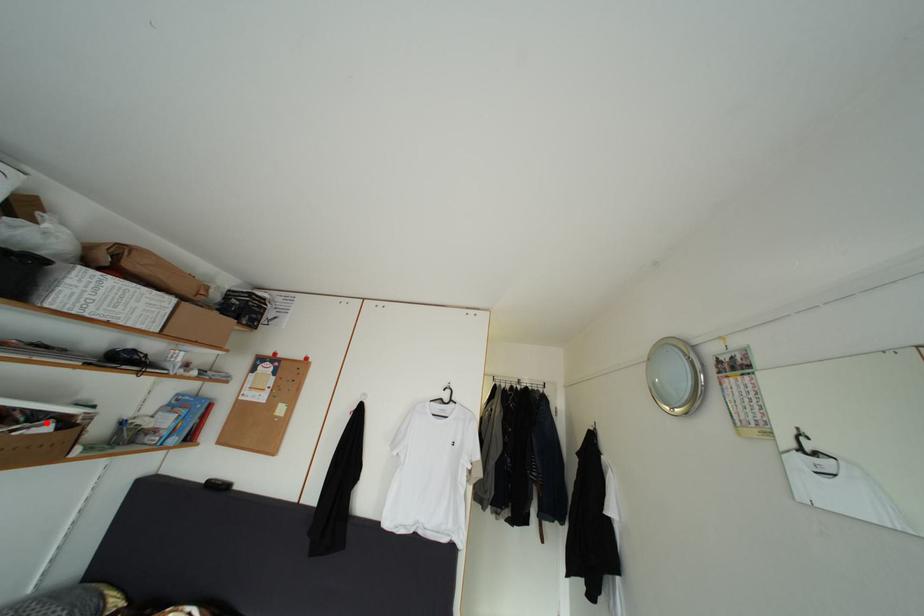
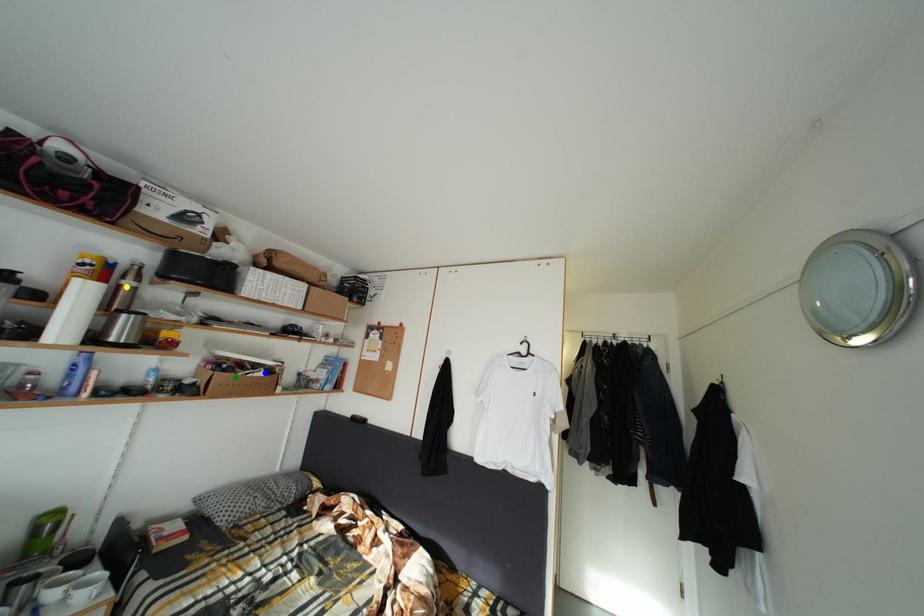
Question: I am providing you with two images of the same scene from different viewpoints. A red point is marked on the first image. You are given multiple points on the second image. Can you choose the point in image 2 that corresponds to the point in image 1?

Choices:
 (A) blue point
 (B) green point
 (C) yellow point

Answer: (A)